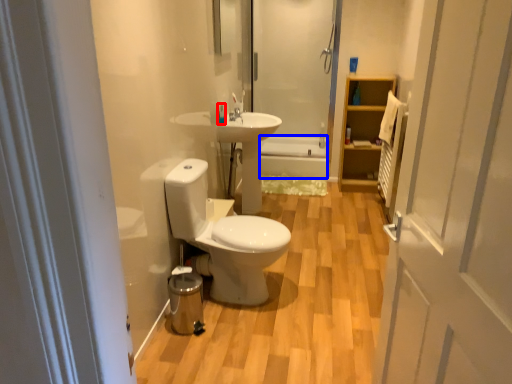
Question: Which object appears farthest to the camera in this image, toiletry (highlighted by a red box) or bath (highlighted by a blue box)?

Choices:
 (A) toiletry
 (B) bath

Answer: (B)